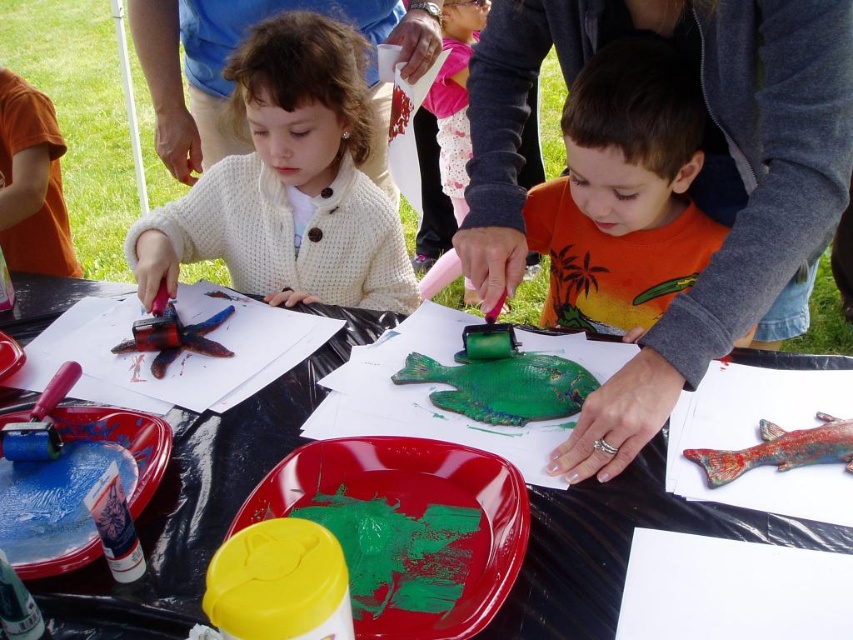
You are a child standing at the edge of the scene and want to reach both the smooth plastic table at center and the green matte paint at center. Which object will you encounter first as you walk towards them?

You will encounter the smooth plastic table at center first because it is closer to you than the green matte paint at center.

You are a child participating in the painting activity and want to reach both the matte plastic plate at center and the blue plastic plate at lower left. Which plate will you need to lean forward more to reach?

You will need to lean forward more to reach the blue plastic plate at lower left because it is further away from you compared to the matte plastic plate at center, which is closer.

You are a child participating in an art activity and want to place the shiny metallic fish at center onto the smooth plastic table at center. Given that the table is 1 meter long, will the fish fit on the table without overlapping the edges?

The distance between the smooth plastic table at center and shiny metallic fish at center is 49.69 centimeters. Since the table is 1 meter long, the fish will fit on the table as the distance is less than the table length.